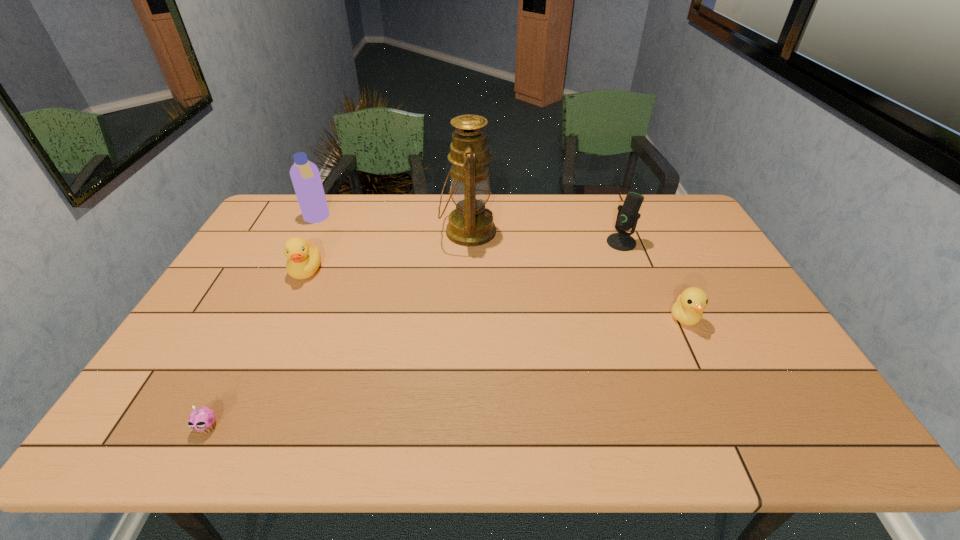
The height and width of the screenshot is (540, 960). I want to click on cupcake, so click(x=202, y=419).

This screenshot has width=960, height=540. I want to click on free region located 0.070m on the front of the oil lamp, so pos(467,269).

Identify the location of free space located 0.080m on the right of the shampoo. (352, 219).

You are a GUI agent. You are given a task and a screenshot of the screen. Output one action in this format:
    pyautogui.click(x=<x>, y=<y>)
    Task: Click on the vacant space located 0.250m on the right of the fourth shortest object
    The image size is (960, 540).
    Given the screenshot: What is the action you would take?
    pyautogui.click(x=710, y=242)

Where is `vacant area situated 0.380m at the beak of the left duck`? The height and width of the screenshot is (540, 960). vacant area situated 0.380m at the beak of the left duck is located at coordinates (249, 394).

I want to click on free region located 0.200m on the face of the shorter duck, so click(723, 397).

Where is `oil lamp that is at the far edge`? This screenshot has height=540, width=960. oil lamp that is at the far edge is located at coordinates (471, 224).

This screenshot has height=540, width=960. In order to click on shampoo located in the far edge section of the desktop in this screenshot , I will do `click(305, 176)`.

Locate an element on the screen. The width and height of the screenshot is (960, 540). object that is at the near edge is located at coordinates (202, 419).

Identify the location of shampoo at the left edge. (305, 176).